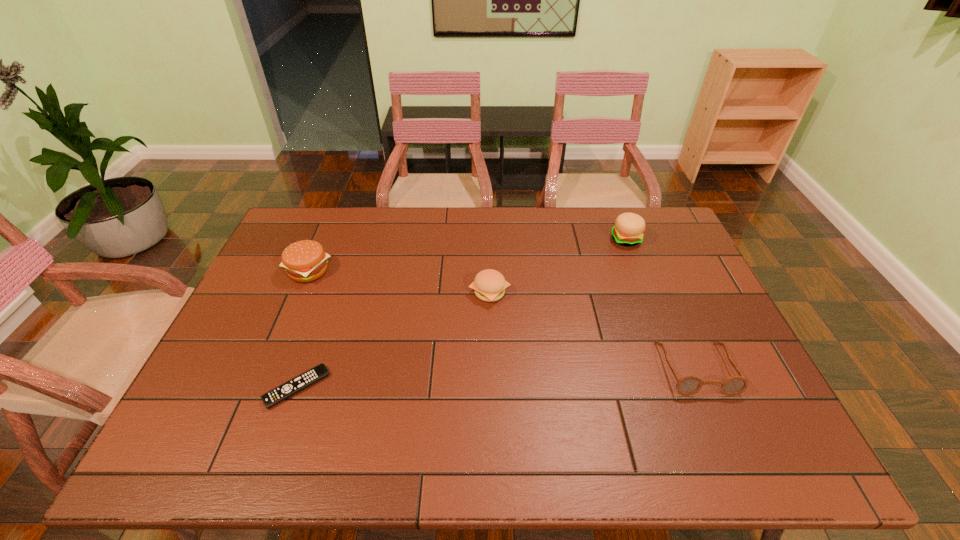
The width and height of the screenshot is (960, 540). What are the coordinates of `vacant point located between the leftmost hamburger and the fourth tallest object` in the screenshot? It's located at (502, 320).

Locate an element on the screen. This screenshot has height=540, width=960. object that is the closest one to the leftmost hamburger is located at coordinates (304, 380).

Identify which object is the second closest to the leftmost hamburger. Please provide its 2D coordinates. Your answer should be formatted as a tuple, i.e. [(x, y)], where the tuple contains the x and y coordinates of a point satisfying the conditions above.

[(489, 285)]

I want to click on the second closest hamburger to the shortest object, so click(x=489, y=285).

Identify the location of hamburger that is the second closest to the leftmost hamburger. This screenshot has height=540, width=960. (628, 230).